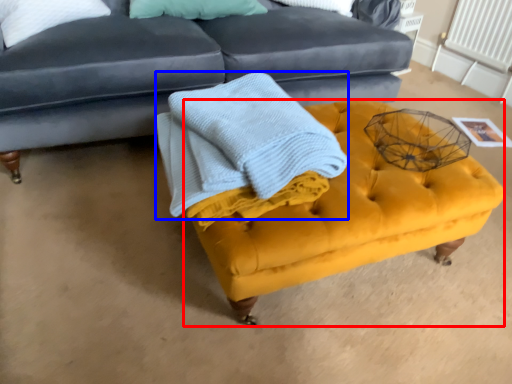
Question: Which of the following is the closest to the observer, swivel chair (highlighted by a red box) or blanket (highlighted by a blue box)?

Choices:
 (A) swivel chair
 (B) blanket

Answer: (B)